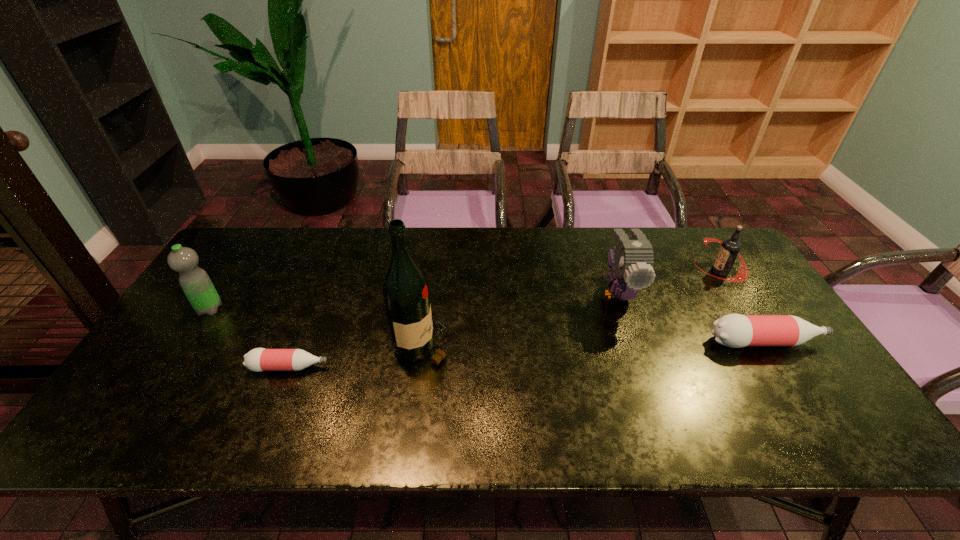
You are a GUI agent. You are given a task and a screenshot of the screen. Output one action in this format:
    pyautogui.click(x=<x>, y=<y>)
    Task: Click on the free space between the shortest object and the wine bottle
    
    Given the screenshot: What is the action you would take?
    pyautogui.click(x=356, y=356)

Identify which object is the fourth nearest to the root beer. Please provide its 2D coordinates. Your answer should be formatted as a tuple, i.e. [(x, y)], where the tuple contains the x and y coordinates of a point satisfying the conditions above.

[(259, 359)]

Select which object is the second closest to the bird. Please provide its 2D coordinates. Your answer should be formatted as a tuple, i.e. [(x, y)], where the tuple contains the x and y coordinates of a point satisfying the conditions above.

[(730, 247)]

Where is `free space that satisfies the following two spatial constraints: 1. at the beak of the bird; 2. on the surface of the tallest object`? free space that satisfies the following two spatial constraints: 1. at the beak of the bird; 2. on the surface of the tallest object is located at coordinates (636, 346).

Find the location of a particular element. blank space that satisfies the following two spatial constraints: 1. at the beak of the bird; 2. with the cap open on the left bottle is located at coordinates (644, 367).